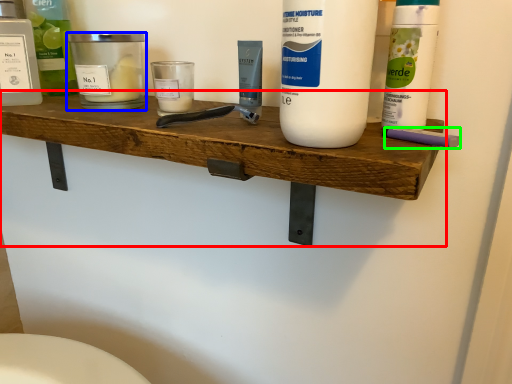
Question: Based on their relative distances, which object is nearer to shelf (highlighted by a red box)? Choose from personal care (highlighted by a blue box) and personal care (highlighted by a green box).

Choices:
 (A) personal care
 (B) personal care

Answer: (A)